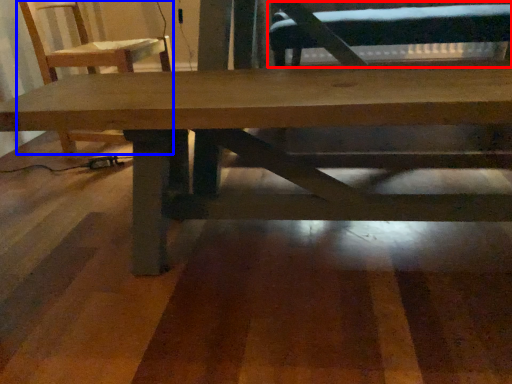
Question: Among these objects, which one is farthest to the camera, swivel chair (highlighted by a red box) or chair (highlighted by a blue box)?

Choices:
 (A) swivel chair
 (B) chair

Answer: (A)